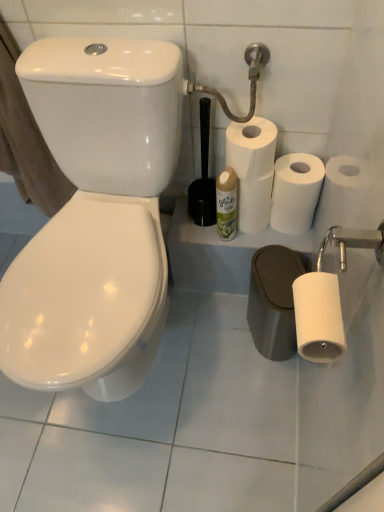
Question: Considering the relative sizes of white matte toilet paper at upper right, arranged as the third toilet paper when viewed from the front, and metallic silver shower head at upper right in the image provided, is white matte toilet paper at upper right, arranged as the third toilet paper when viewed from the front, bigger than metallic silver shower head at upper right?

Choices:
 (A) yes
 (B) no

Answer: (B)

Question: Does white matte toilet paper at upper right, placed as the 1th toilet paper when sorted from back to front, have a lesser width compared to metallic silver shower head at upper right?

Choices:
 (A) no
 (B) yes

Answer: (A)

Question: Is the position of white matte toilet paper at upper right, the second toilet paper when ordered from top to bottom, more distant than that of metallic silver shower head at upper right?

Choices:
 (A) yes
 (B) no

Answer: (A)

Question: Considering the relative sizes of white matte toilet paper at upper right, which is counted as the 2th toilet paper, starting from the bottom, and metallic silver shower head at upper right in the image provided, is white matte toilet paper at upper right, which is counted as the 2th toilet paper, starting from the bottom, taller than metallic silver shower head at upper right?

Choices:
 (A) no
 (B) yes

Answer: (A)

Question: From a real-world perspective, is white matte toilet paper at upper right, placed as the 1th toilet paper when sorted from back to front, beneath metallic silver shower head at upper right?

Choices:
 (A) no
 (B) yes

Answer: (B)

Question: From a real-world perspective, is brown cotton bath towel at left above or below white matte toilet paper at center right, the 2th toilet paper from the front?

Choices:
 (A) below
 (B) above

Answer: (A)

Question: Is brown cotton bath towel at left to the left or to the right of white matte toilet paper at center right, placed as the 1th toilet paper when sorted from top to bottom, in the image?

Choices:
 (A) right
 (B) left

Answer: (B)

Question: Choose the correct answer: Is brown cotton bath towel at left inside white matte toilet paper at center right, the 2th toilet paper in the back-to-front sequence, or outside it?

Choices:
 (A) inside
 (B) outside

Answer: (B)

Question: Considering the positions of brown cotton bath towel at left and white matte toilet paper at center right, placed as the 1th toilet paper when sorted from top to bottom, in the image, is brown cotton bath towel at left wider or thinner than white matte toilet paper at center right, placed as the 1th toilet paper when sorted from top to bottom,?

Choices:
 (A) wide
 (B) thin

Answer: (A)

Question: Is point (56, 201) closer or farther from the camera than point (233, 189)?

Choices:
 (A) closer
 (B) farther

Answer: (B)

Question: Is brown cotton bath towel at left spatially inside green matte spray can at center, or outside of it?

Choices:
 (A) outside
 (B) inside

Answer: (A)

Question: Considering the positions of brown cotton bath towel at left and green matte spray can at center in the image, is brown cotton bath towel at left taller or shorter than green matte spray can at center?

Choices:
 (A) tall
 (B) short

Answer: (A)

Question: From a real-world perspective, is brown cotton bath towel at left physically located above or below green matte spray can at center?

Choices:
 (A) below
 (B) above

Answer: (B)

Question: From the image's perspective, is white matte paper towel at center located above or below white matte toilet paper at lower right, arranged as the 1th toilet paper when ordered from the bottom?

Choices:
 (A) above
 (B) below

Answer: (A)

Question: In the image, is white matte paper towel at center on the left side or the right side of white matte toilet paper at lower right, arranged as the third toilet paper when viewed from the top?

Choices:
 (A) right
 (B) left

Answer: (A)